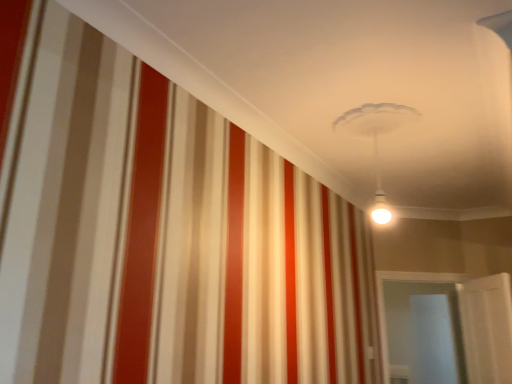
Measure the distance between white glossy door at lower right and camera.

They are 9.14 feet apart.

Describe the element at coordinates (487, 328) in the screenshot. Image resolution: width=512 pixels, height=384 pixels. I see `white glossy door at lower right` at that location.

In order to face white glossy door at lower right, should I rotate leftwards or rightwards?

Turn right approximately 29.248 degrees to face it.

Image resolution: width=512 pixels, height=384 pixels. What are the coordinates of `white glossy door at lower right` in the screenshot? It's located at click(487, 328).

This screenshot has width=512, height=384. What do you see at coordinates (423, 332) in the screenshot?
I see `transparent glass door at lower right` at bounding box center [423, 332].

What is the approximate height of transparent glass door at lower right?

It is 37.15 inches.

Identify the location of transparent glass door at lower right. (423, 332).

The image size is (512, 384). I want to click on white glossy door at lower right, so click(487, 328).

Visually, is white glossy door at lower right positioned to the left or to the right of transparent glass door at lower right?

Based on their positions, white glossy door at lower right is located to the right of transparent glass door at lower right.

Considering the positions of objects white glossy door at lower right and transparent glass door at lower right in the image provided, who is in front, white glossy door at lower right or transparent glass door at lower right?

white glossy door at lower right.

Considering the positions of point (503, 276) and point (421, 381), is point (503, 276) closer or farther from the camera than point (421, 381)?

Point (503, 276) appears to be closer to the viewer than point (421, 381).

From the image's perspective, is white glossy door at lower right beneath transparent glass door at lower right?

No, from the image's perspective, white glossy door at lower right is not beneath transparent glass door at lower right.

From a real-world perspective, which object stands above the other?

transparent glass door at lower right.

Which object is wider, white glossy door at lower right or transparent glass door at lower right?

transparent glass door at lower right.

Which of these two, white glossy door at lower right or transparent glass door at lower right, stands shorter?

white glossy door at lower right.

Looking at this image, considering the sizes of white glossy door at lower right and transparent glass door at lower right in the image, is white glossy door at lower right bigger or smaller than transparent glass door at lower right?

Clearly, white glossy door at lower right is smaller in size than transparent glass door at lower right.

From the picture: Would you say white glossy door at lower right is outside transparent glass door at lower right?

Absolutely, white glossy door at lower right is external to transparent glass door at lower right.

Is the surface of white glossy door at lower right in direct contact with transparent glass door at lower right?

white glossy door at lower right is not next to transparent glass door at lower right, and they're not touching.

Is white glossy door at lower right oriented away from transparent glass door at lower right?

No.

How many degrees apart are the facing directions of white glossy door at lower right and transparent glass door at lower right?

94.5 degrees.

Measure the distance between white glossy door at lower right and transparent glass door at lower right.

white glossy door at lower right and transparent glass door at lower right are 1.84 meters apart from each other.

Find the location of a particular element. door on the right of transparent glass door at lower right is located at coordinates (487, 328).

In the image, is transparent glass door at lower right on the left side or the right side of white glossy door at lower right?

transparent glass door at lower right is to the left of white glossy door at lower right.

Considering the relative positions of transparent glass door at lower right and white glossy door at lower right in the image provided, is transparent glass door at lower right in front of white glossy door at lower right?

No, it is not.

Which is closer to the camera, (428, 340) or (463, 311)?

Clearly, point (428, 340) is more distant from the camera than point (463, 311).

From the image's perspective, is transparent glass door at lower right beneath white glossy door at lower right?

Yes.

From a real-world perspective, does transparent glass door at lower right stand above white glossy door at lower right?

Yes, from a real-world perspective, transparent glass door at lower right is above white glossy door at lower right.

Looking at this image, considering the relative sizes of transparent glass door at lower right and white glossy door at lower right in the image provided, is transparent glass door at lower right thinner than white glossy door at lower right?

No, transparent glass door at lower right is not thinner than white glossy door at lower right.

Considering the sizes of objects transparent glass door at lower right and white glossy door at lower right in the image provided, who is taller, transparent glass door at lower right or white glossy door at lower right?

transparent glass door at lower right is taller.

Is transparent glass door at lower right bigger or smaller than white glossy door at lower right?

Considering their sizes, transparent glass door at lower right takes up more space than white glossy door at lower right.

Is white glossy door at lower right surrounded by transparent glass door at lower right?

No, white glossy door at lower right is not a part of transparent glass door at lower right.

Is transparent glass door at lower right far from white glossy door at lower right?

Indeed, transparent glass door at lower right is not near white glossy door at lower right.

Is transparent glass door at lower right looking in the opposite direction of white glossy door at lower right?

No, transparent glass door at lower right is not facing the opposite direction of white glossy door at lower right.

Can you tell me how much transparent glass door at lower right and white glossy door at lower right differ in facing direction?

94.5 degrees.

How far apart are transparent glass door at lower right and white glossy door at lower right?

The distance of transparent glass door at lower right from white glossy door at lower right is 1.84 meters.

This screenshot has height=384, width=512. What are the coordinates of `door to the right of transparent glass door at lower right` in the screenshot? It's located at (487, 328).

At what (x,y) coordinates should I click in order to perform the action: click on door on the right of transparent glass door at lower right. Please return your answer as a coordinate pair (x, y). Looking at the image, I should click on (487, 328).

This screenshot has height=384, width=512. Find the location of `door in front of the transparent glass door at lower right`. door in front of the transparent glass door at lower right is located at coordinates (487, 328).